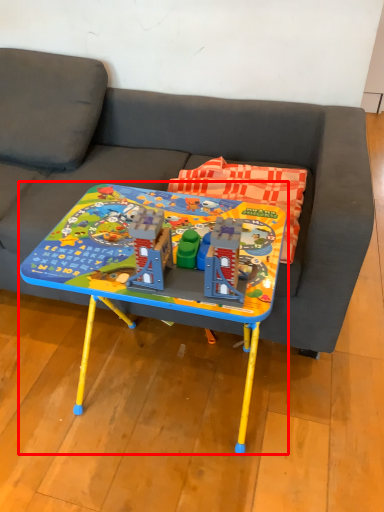
Question: From the image, what is the correct spatial relationship of table (annotated by the red box) in relation to studio couch?

Choices:
 (A) left
 (B) right

Answer: (B)